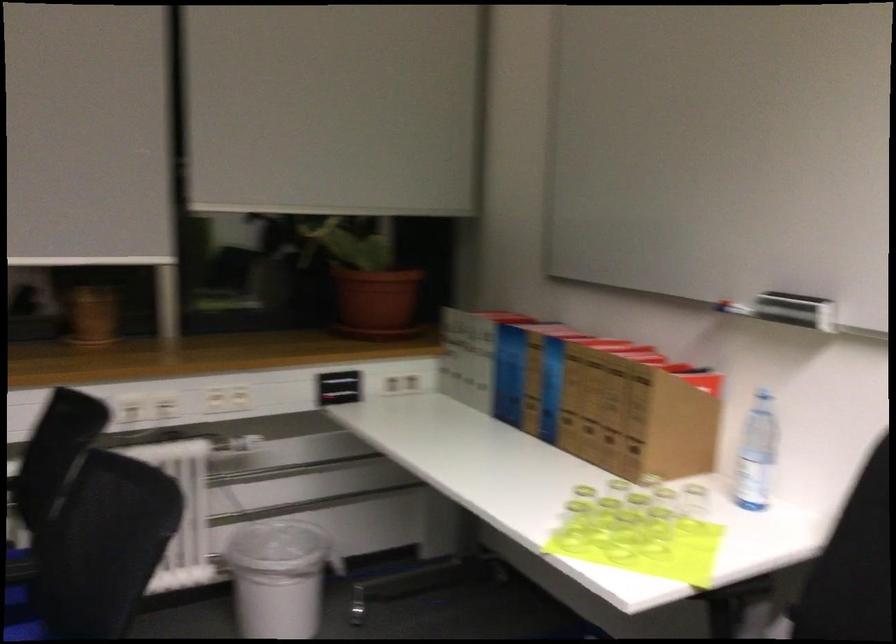
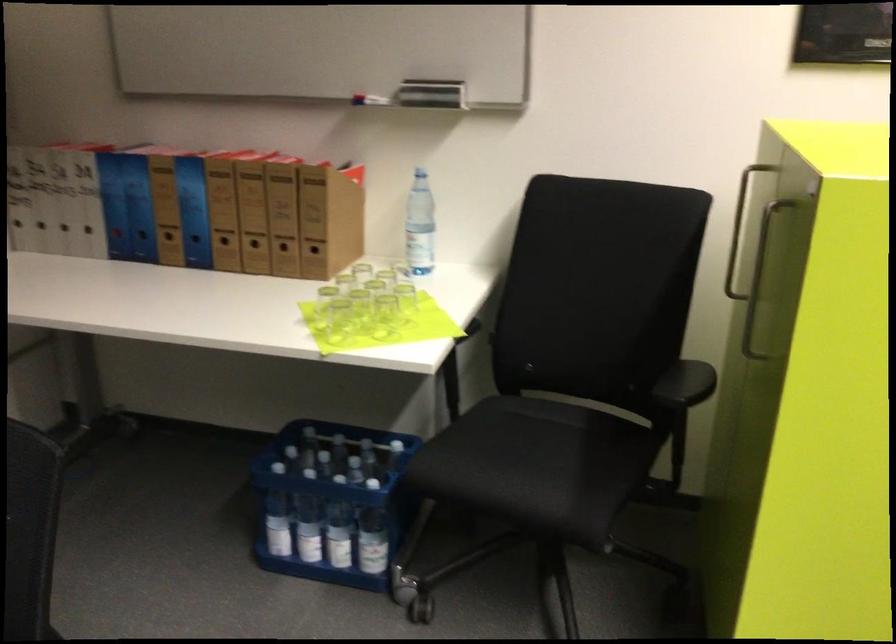
Where in the second image is the point corresponding to the point at 767,453 from the first image?

(419, 225)